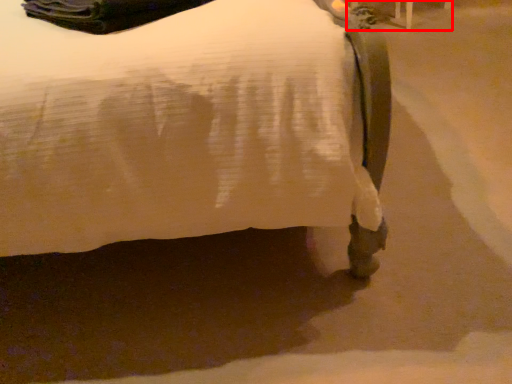
Question: From the image's perspective, where is furniture (annotated by the red box) located relative to bed?

Choices:
 (A) above
 (B) below

Answer: (A)